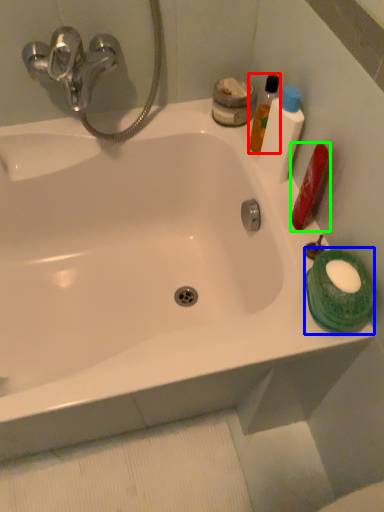
Question: Considering the real-world distances, which object is closest to mouthwash (highlighted by a red box)? mouthwash (highlighted by a blue box) or mouthwash (highlighted by a green box).

Choices:
 (A) mouthwash
 (B) mouthwash

Answer: (B)